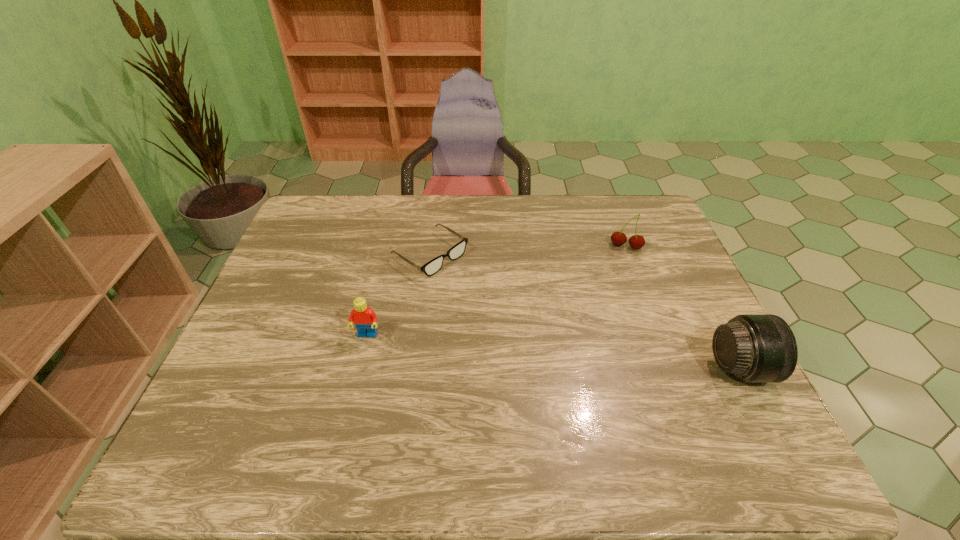
Where is `vacant space that satisfies the following two spatial constraints: 1. on the face of the rightmost object; 2. on the front-facing side of the second nearest object`? The image size is (960, 540). vacant space that satisfies the following two spatial constraints: 1. on the face of the rightmost object; 2. on the front-facing side of the second nearest object is located at coordinates (359, 368).

The image size is (960, 540). In order to click on free point that satisfies the following two spatial constraints: 1. on the face of the second nearest object; 2. on the front-facing side of the telephoto lens in this screenshot , I will do `click(359, 368)`.